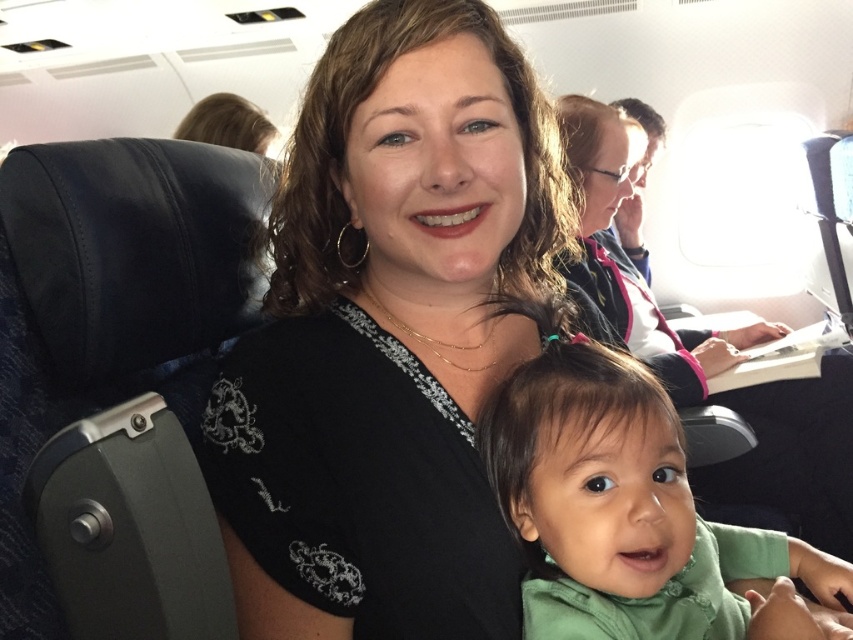
You are a flight attendant checking the seating arrangement. You need to locate the black embroidered shirt at center. Where exactly is it positioned in the cabin?

The black embroidered shirt at center is located at point (390, 336) in the cabin.

You are a flight attendant standing at the front of the airplane cabin. You need to reach a specific point in the cabin to assist a passenger. The point is located at coordinates point (376, 492). If your outstretched arm can reach up to 60 centimeters, will you be able to reach that point without moving closer?

The distance of point (376, 492) from viewer is 64.48 centimeters. Since the point is 64.48 cm away and your arm can only reach 60 cm, you cannot reach it without moving closer.